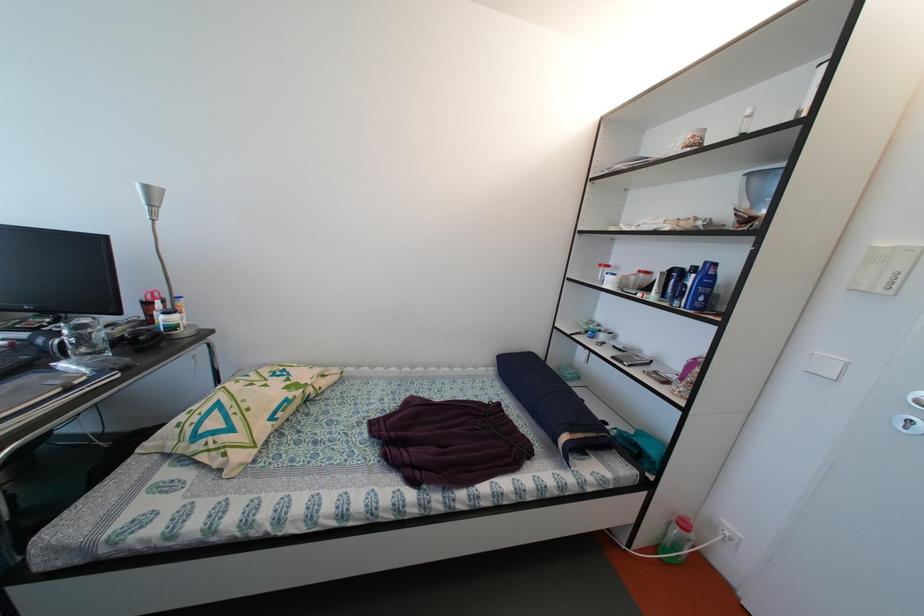
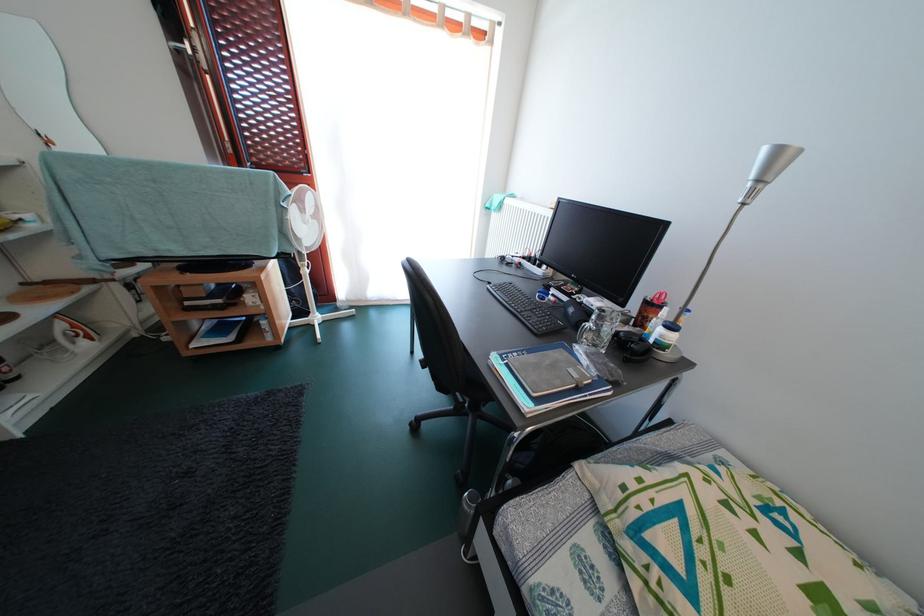
Locate, in the second image, the point that corresponds to (x=156, y=350) in the first image.

(640, 360)